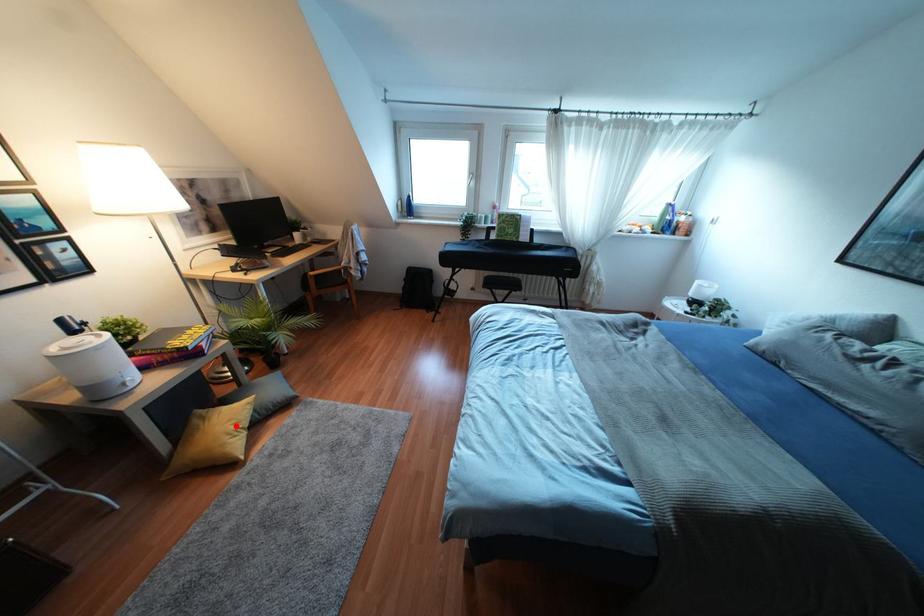
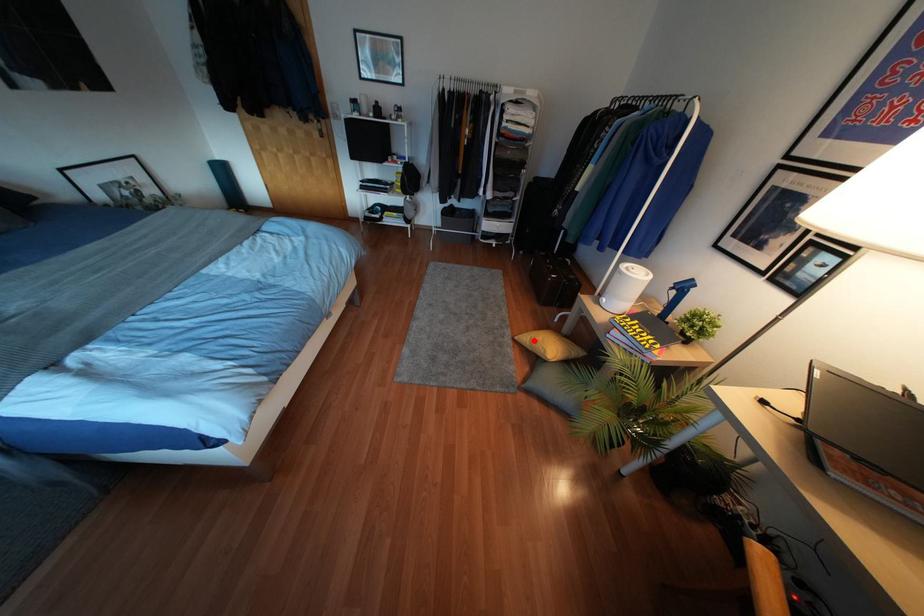
I am providing you with two images of the same scene from different viewpoints. A red point is marked on the first image and another point is marked on the second image. Is the red point in image1 aligned with the point shown in image2?

Yes